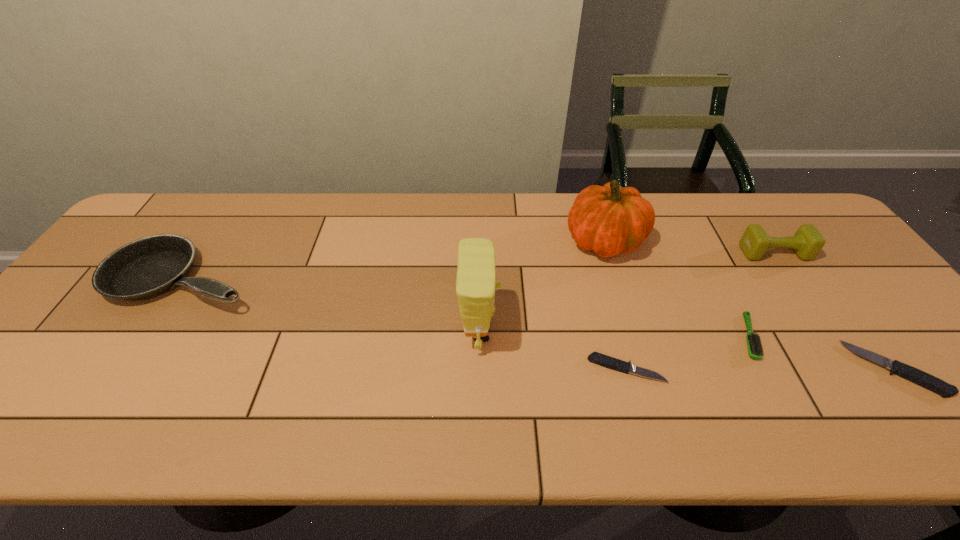
What are the coordinates of `blank space located on the left of the left steak knife` in the screenshot? It's located at (540, 369).

The image size is (960, 540). Find the location of `vacant space positioned 0.390m on the left of the sixth tallest object`. vacant space positioned 0.390m on the left of the sixth tallest object is located at coordinates (684, 369).

This screenshot has height=540, width=960. Identify the location of free space located 0.120m on the right of the pumpkin. (685, 241).

This screenshot has height=540, width=960. Identify the location of vacant space located 0.140m on the left of the dumbbell. click(693, 253).

Locate an element on the screen. The width and height of the screenshot is (960, 540). vacant space situated 0.050m on the back of the frying pan is located at coordinates (214, 234).

At what (x,y) coordinates should I click in order to perform the action: click on free point located on the face of the sponge. Please return your answer as a coordinate pair (x, y). Image resolution: width=960 pixels, height=540 pixels. Looking at the image, I should click on (524, 332).

Locate an element on the screen. free space located 0.280m on the back of the fifth object from left to right is located at coordinates (699, 241).

Find the location of `object situated at the far edge`. object situated at the far edge is located at coordinates (609, 219).

Where is `object located in the left edge section of the desktop`? Image resolution: width=960 pixels, height=540 pixels. object located in the left edge section of the desktop is located at coordinates (150, 266).

Where is `steak knife located in the right edge section of the desktop`? This screenshot has width=960, height=540. steak knife located in the right edge section of the desktop is located at coordinates (912, 374).